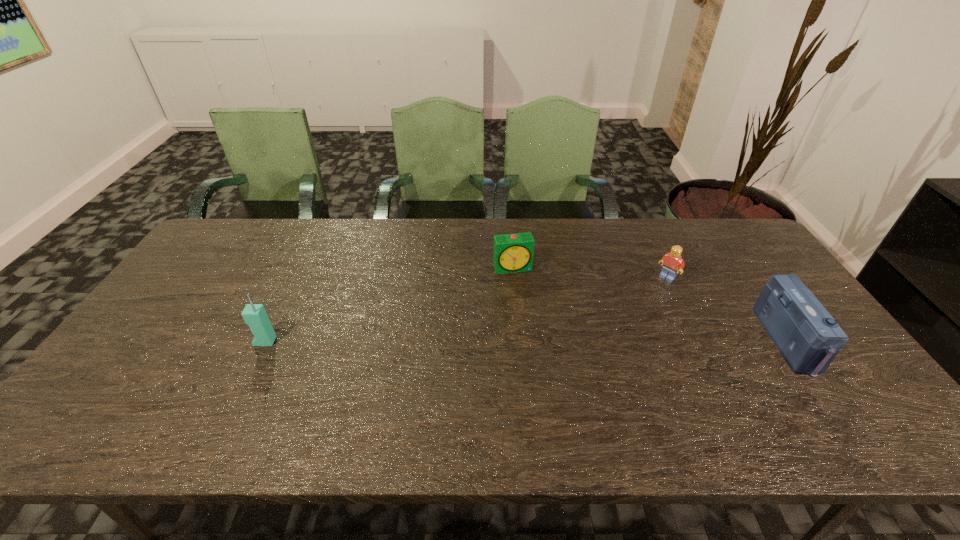
You are a GUI agent. You are given a task and a screenshot of the screen. Output one action in this format:
    pyautogui.click(x=<x>, y=<y>)
    Task: Click on the vacant area that lies between the second object from left to right and the Lego
    The image size is (960, 540).
    Given the screenshot: What is the action you would take?
    pyautogui.click(x=590, y=273)

Find the location of `free area in between the camera and the leftmost object`. free area in between the camera and the leftmost object is located at coordinates (527, 341).

Where is `unoccupied area between the Lego and the rightmost object`? The image size is (960, 540). unoccupied area between the Lego and the rightmost object is located at coordinates (728, 309).

Select which object appears as the second closest to the rightmost object. Please provide its 2D coordinates. Your answer should be formatted as a tuple, i.e. [(x, y)], where the tuple contains the x and y coordinates of a point satisfying the conditions above.

[(512, 253)]

The width and height of the screenshot is (960, 540). What are the coordinates of `object identified as the closest to the rightmost object` in the screenshot? It's located at (672, 261).

Locate an element on the screen. free location that satisfies the following two spatial constraints: 1. on the front side of the third object from left to right; 2. on the lens of the camera is located at coordinates (698, 341).